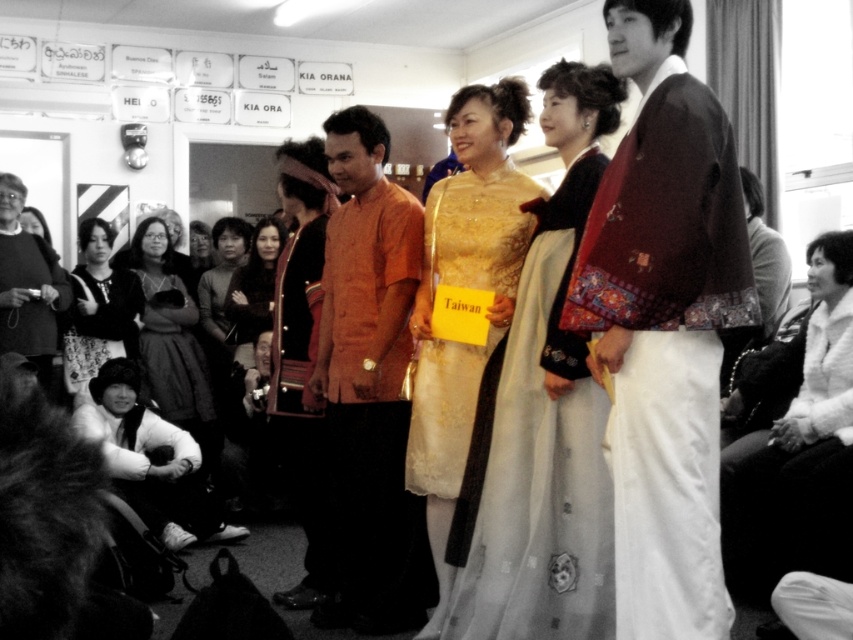
In the scene shown: Which is above, smooth white blouse at lower right or matte orange blouse at center?

matte orange blouse at center is above.

The image size is (853, 640). Describe the element at coordinates (798, 445) in the screenshot. I see `smooth white blouse at lower right` at that location.

Does point (781, 528) come behind point (320, 538)?

Yes, it is.

Locate an element on the screen. The image size is (853, 640). smooth white blouse at lower right is located at coordinates (798, 445).

Who is taller, dark gray dress at lower left or matte black sweater at left?

Standing taller between the two is dark gray dress at lower left.

Can you confirm if dark gray dress at lower left is wider than matte black sweater at left?

Yes, dark gray dress at lower left is wider than matte black sweater at left.

Find the location of a particular element. The image size is (853, 640). dark gray dress at lower left is located at coordinates (171, 339).

Can you confirm if matte black sweater at left is positioned above fluffy black hat at lower left?

Correct, matte black sweater at left is located above fluffy black hat at lower left.

Describe the element at coordinates (27, 285) in the screenshot. I see `matte black sweater at left` at that location.

Identify the location of matte black sweater at left. Image resolution: width=853 pixels, height=640 pixels. (27, 285).